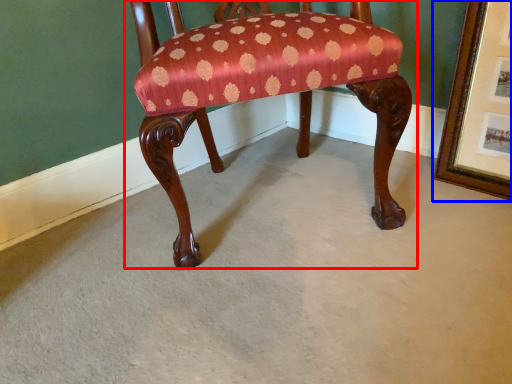
Question: Which point is further to the camera, chair (highlighted by a red box) or picture frame (highlighted by a blue box)?

Choices:
 (A) chair
 (B) picture frame

Answer: (B)